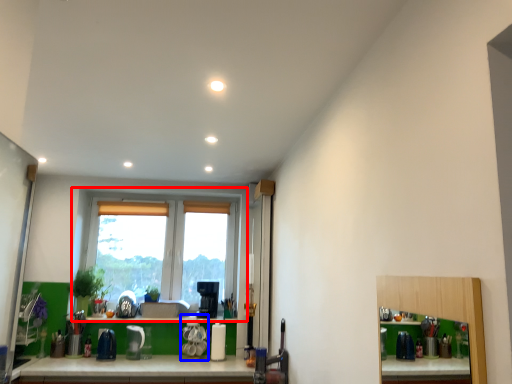
Question: Which object is further to the camera taking this photo, window (highlighted by a red box) or appliance (highlighted by a blue box)?

Choices:
 (A) window
 (B) appliance

Answer: (A)